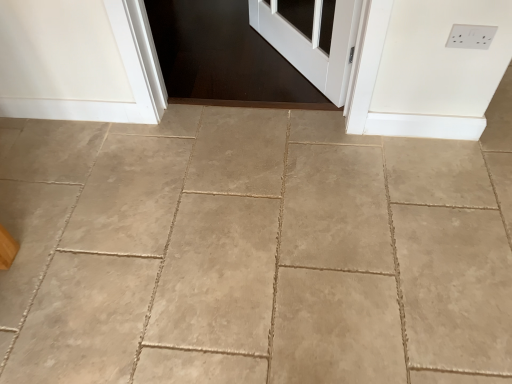
Question: Is white plastic electric outlet at upper right not close to beige tile floor at center?

Choices:
 (A) no
 (B) yes

Answer: (B)

Question: From the image's perspective, would you say white plastic electric outlet at upper right is positioned over beige tile floor at center?

Choices:
 (A) no
 (B) yes

Answer: (B)

Question: Is white plastic electric outlet at upper right in front of beige tile floor at center?

Choices:
 (A) yes
 (B) no

Answer: (B)

Question: Can we say white plastic electric outlet at upper right lies outside beige tile floor at center?

Choices:
 (A) yes
 (B) no

Answer: (A)

Question: From a real-world perspective, is white plastic electric outlet at upper right located beneath beige tile floor at center?

Choices:
 (A) yes
 (B) no

Answer: (B)

Question: Is white plastic electric outlet at upper right thinner than beige tile floor at center?

Choices:
 (A) no
 (B) yes

Answer: (B)

Question: From a real-world perspective, is beige tile floor at center on white plastic electric outlet at upper right?

Choices:
 (A) yes
 (B) no

Answer: (B)

Question: Considering the relative sizes of beige tile floor at center and white plastic electric outlet at upper right in the image provided, is beige tile floor at center thinner than white plastic electric outlet at upper right?

Choices:
 (A) no
 (B) yes

Answer: (A)

Question: Would you say white plastic electric outlet at upper right is part of beige tile floor at center's contents?

Choices:
 (A) no
 (B) yes

Answer: (A)

Question: Can you see beige tile floor at center touching white plastic electric outlet at upper right?

Choices:
 (A) no
 (B) yes

Answer: (A)

Question: Is beige tile floor at center to the right of white plastic electric outlet at upper right from the viewer's perspective?

Choices:
 (A) yes
 (B) no

Answer: (B)

Question: Is beige tile floor at center positioned beyond the bounds of white plastic electric outlet at upper right?

Choices:
 (A) no
 (B) yes

Answer: (B)

Question: Considering the relative positions of beige tile floor at center and white plastic electric outlet at upper right in the image provided, is beige tile floor at center to the left or to the right of white plastic electric outlet at upper right?

Choices:
 (A) right
 (B) left

Answer: (B)